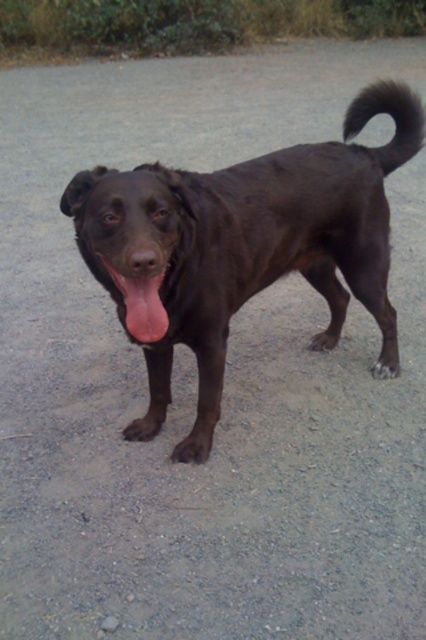
Question: Is shiny black dog at center below pink glossy tongue at center?

Choices:
 (A) no
 (B) yes

Answer: (A)

Question: Does shiny black dog at center appear over pink glossy tongue at center?

Choices:
 (A) no
 (B) yes

Answer: (B)

Question: Which object appears closest to the camera in this image?

Choices:
 (A) shiny black dog at center
 (B) pink glossy tongue at center

Answer: (A)

Question: Observing the image, what is the correct spatial positioning of shiny black dog at center in reference to pink glossy tongue at center?

Choices:
 (A) below
 (B) above

Answer: (B)

Question: Which point is closer to the camera taking this photo?

Choices:
 (A) (359, 253)
 (B) (149, 332)

Answer: (B)